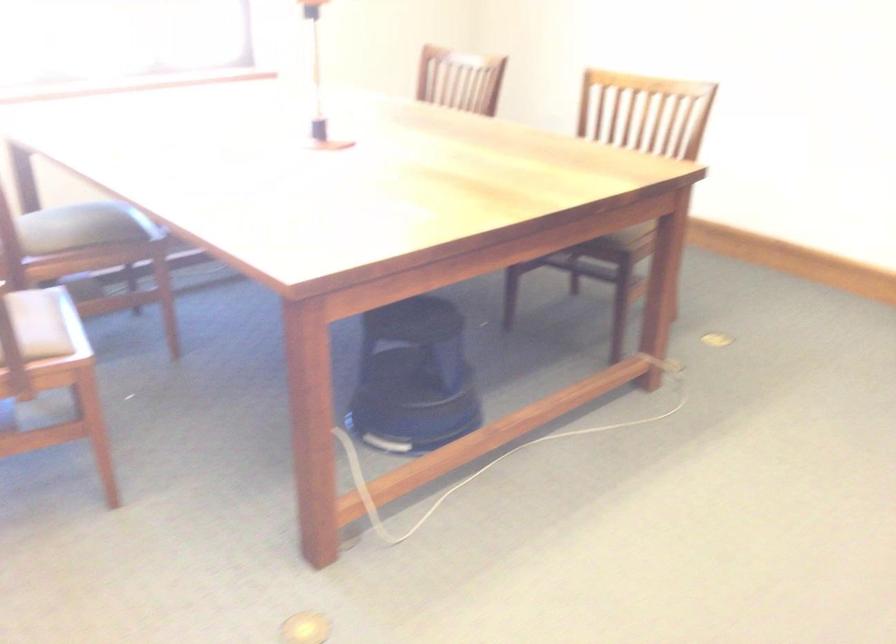
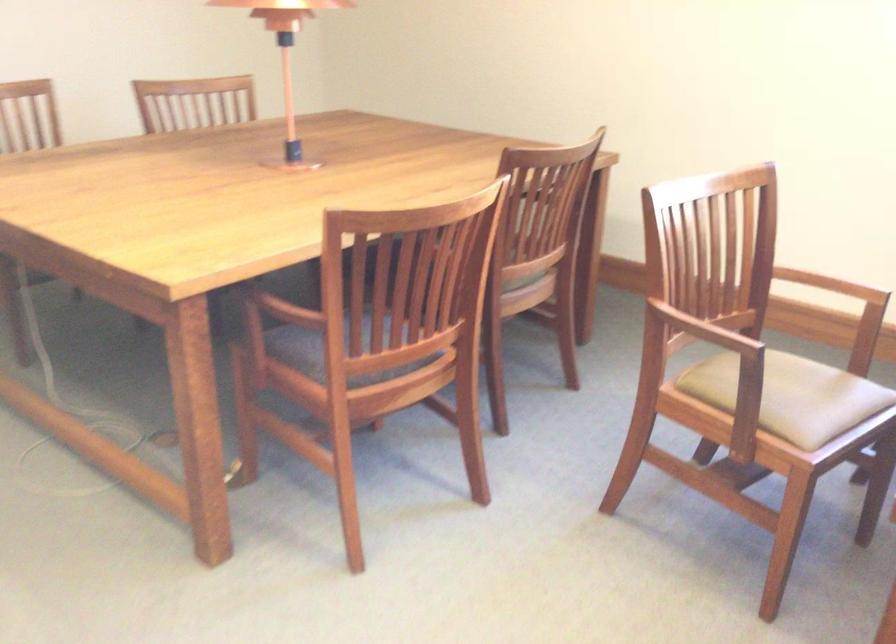
Question: The images are taken continuously from a first-person perspective. In which direction is your viewpoint rotating?

Choices:
 (A) Left
 (B) Right
 (C) Up
 (D) Down

Answer: (A)